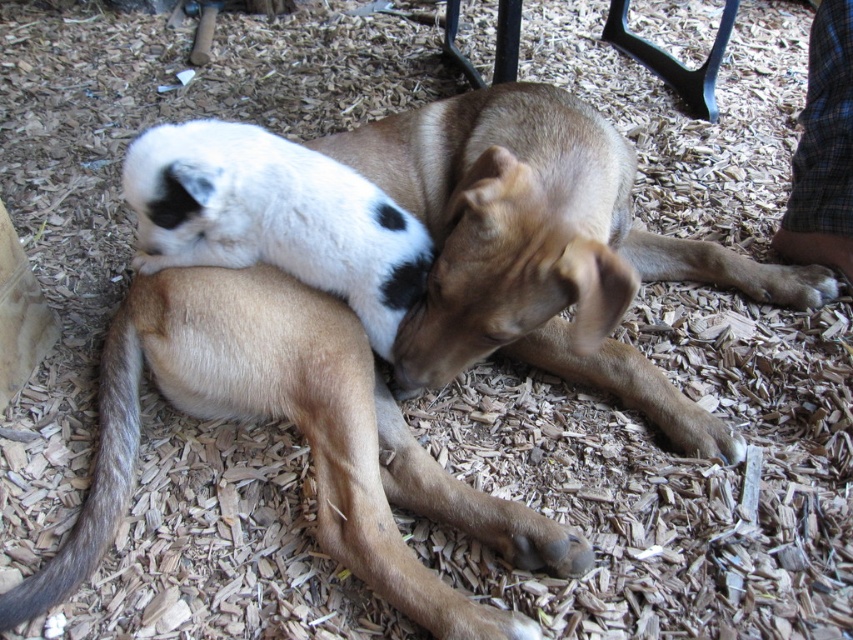
Question: Does brown fur dog at center have a lesser width compared to metallic blue chair at upper center?

Choices:
 (A) no
 (B) yes

Answer: (A)

Question: Which object is positioned farthest from the gray-furred tail at lower left?

Choices:
 (A) light brown fur dog at center
 (B) metallic blue chair at upper center
 (C) brown fur dog at center

Answer: (B)

Question: Which object is positioned closest to the metallic blue chair at upper center?

Choices:
 (A) gray-furred tail at lower left
 (B) brown fur dog at center

Answer: (B)

Question: Which of the following is the farthest from the observer?

Choices:
 (A) gray-furred tail at lower left
 (B) metallic blue chair at upper center
 (C) light brown fur dog at center

Answer: (B)

Question: Is gray-furred tail at lower left wider than metallic blue chair at upper center?

Choices:
 (A) no
 (B) yes

Answer: (A)

Question: Does light brown fur dog at center have a smaller size compared to brown fur dog at center?

Choices:
 (A) no
 (B) yes

Answer: (A)